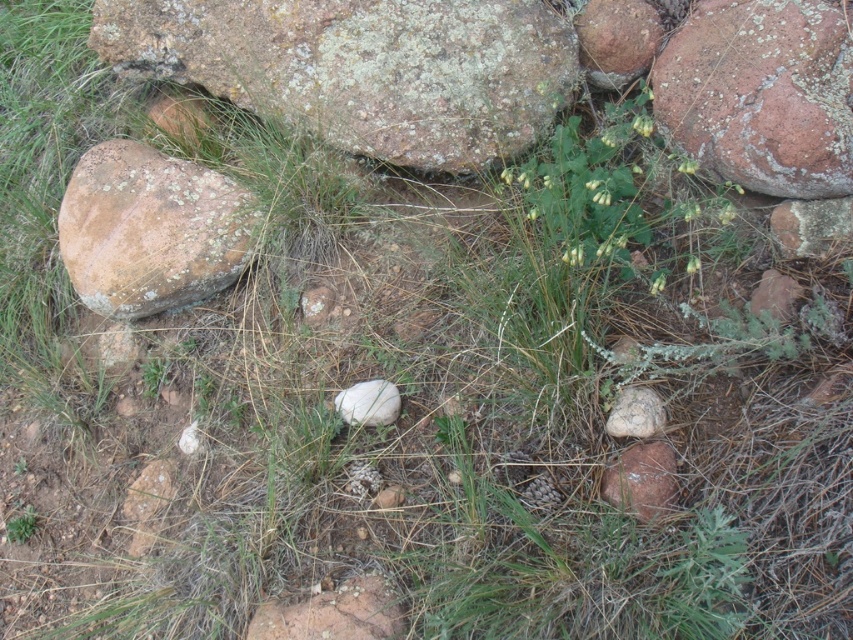
You are a gardener trying to identify plants in this outdoor scene. You notice the rusty stone at upper right and the green leafy plant at lower left. Which one takes up more space in the image?

The rusty stone at upper right is larger in size than the green leafy plant at lower left, so it takes up more space in the image.

You are a botanist examining the speckled brown rock at right and the green matte flower at center. Which object is positioned to the east of the other?

The speckled brown rock at right is to the right of green matte flower at center, so it is positioned to the east of the green matte flower at center.